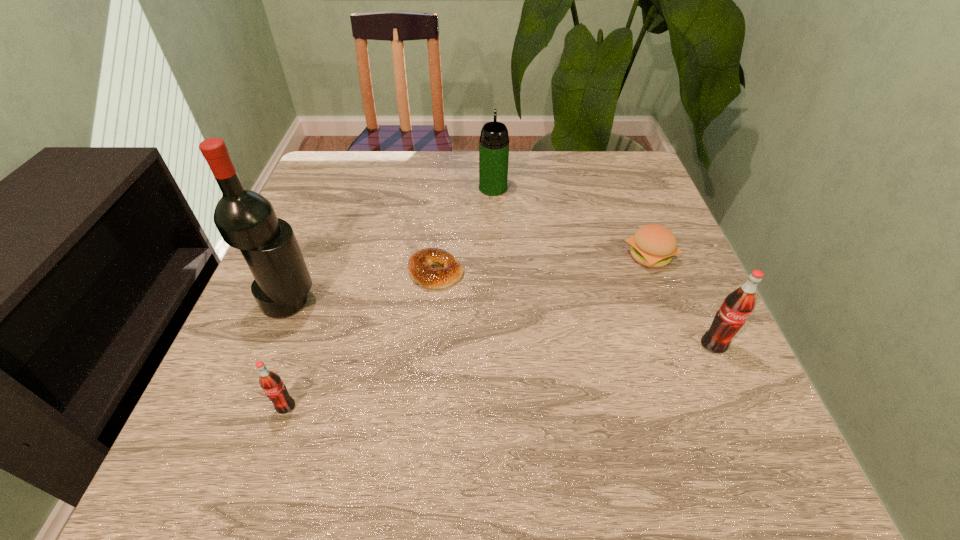
Image resolution: width=960 pixels, height=540 pixels. In order to click on vacant area between the fifth tallest object and the taller soda bottle in this screenshot , I will do `click(682, 301)`.

Image resolution: width=960 pixels, height=540 pixels. Find the location of `blank region between the shortest object and the left soda bottle`. blank region between the shortest object and the left soda bottle is located at coordinates pos(361,339).

Select which object appears as the closest to the thermos bottle. Please provide its 2D coordinates. Your answer should be formatted as a tuple, i.e. [(x, y)], where the tuple contains the x and y coordinates of a point satisfying the conditions above.

[(419, 265)]

Where is `the fifth closest object relative to the right soda bottle`? The width and height of the screenshot is (960, 540). the fifth closest object relative to the right soda bottle is located at coordinates (246, 220).